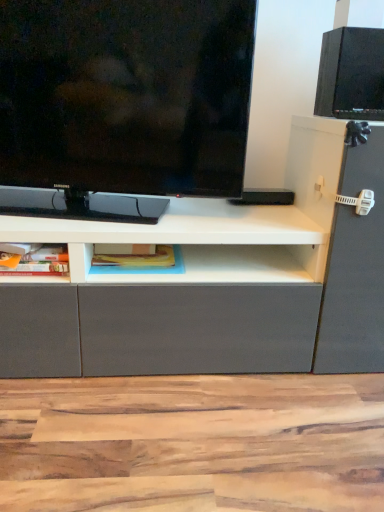
Question: Can you see matte plastic container at lower left, which is the second cabinet from right to left, touching blue matte bookshelf at center, acting as the 2th cabinet starting from the left?

Choices:
 (A) yes
 (B) no

Answer: (B)

Question: Is blue matte bookshelf at center, acting as the 2th cabinet starting from the left, at the back of matte plastic container at lower left, which is the second cabinet from right to left?

Choices:
 (A) yes
 (B) no

Answer: (B)

Question: Does matte plastic container at lower left, placed as the first cabinet when sorted from left to right, have a greater height compared to blue matte bookshelf at center, the first cabinet positioned from the right?

Choices:
 (A) yes
 (B) no

Answer: (A)

Question: Could you tell me if matte plastic container at lower left, placed as the first cabinet when sorted from left to right, is facing blue matte bookshelf at center, acting as the 2th cabinet starting from the left?

Choices:
 (A) no
 (B) yes

Answer: (A)

Question: Is matte plastic container at lower left, placed as the first cabinet when sorted from left to right, not within blue matte bookshelf at center, the first cabinet positioned from the right?

Choices:
 (A) no
 (B) yes

Answer: (B)

Question: Is blue matte bookshelf at center, acting as the 2th cabinet starting from the left, situated inside matte black tv at upper left or outside?

Choices:
 (A) outside
 (B) inside

Answer: (A)

Question: From a real-world perspective, relative to matte black tv at upper left, is blue matte bookshelf at center, the first cabinet positioned from the right, vertically above or below?

Choices:
 (A) below
 (B) above

Answer: (A)

Question: Looking at the image, does blue matte bookshelf at center, acting as the 2th cabinet starting from the left, seem bigger or smaller compared to matte black tv at upper left?

Choices:
 (A) big
 (B) small

Answer: (B)

Question: In terms of width, does blue matte bookshelf at center, acting as the 2th cabinet starting from the left, look wider or thinner when compared to matte black tv at upper left?

Choices:
 (A) thin
 (B) wide

Answer: (B)

Question: From a real-world perspective, is matte black tv at upper left above or below matte plastic container at lower left, which is the second cabinet from right to left?

Choices:
 (A) above
 (B) below

Answer: (A)

Question: Would you say matte black tv at upper left is inside or outside matte plastic container at lower left, placed as the first cabinet when sorted from left to right?

Choices:
 (A) outside
 (B) inside

Answer: (A)

Question: From the image's perspective, is matte black tv at upper left located above or below matte plastic container at lower left, placed as the first cabinet when sorted from left to right?

Choices:
 (A) below
 (B) above

Answer: (B)

Question: In the image, is matte black tv at upper left positioned in front of or behind matte plastic container at lower left, which is the second cabinet from right to left?

Choices:
 (A) front
 (B) behind

Answer: (A)

Question: Considering the positions of blue matte bookshelf at center, the first cabinet positioned from the right, and black matte speaker at upper right in the image, is blue matte bookshelf at center, the first cabinet positioned from the right, taller or shorter than black matte speaker at upper right?

Choices:
 (A) short
 (B) tall

Answer: (A)

Question: Relative to black matte speaker at upper right, is blue matte bookshelf at center, the first cabinet positioned from the right, in front or behind?

Choices:
 (A) front
 (B) behind

Answer: (A)